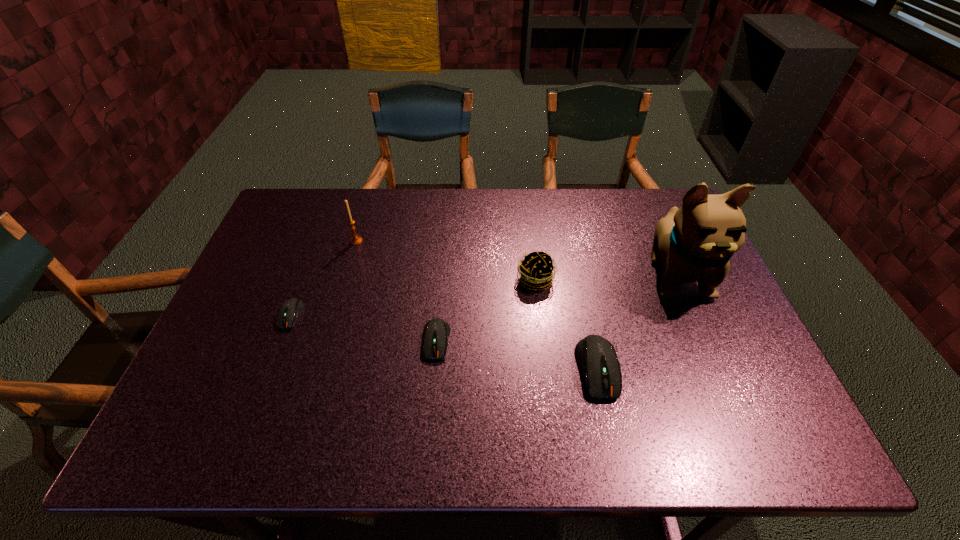
You are a GUI agent. You are given a task and a screenshot of the screen. Output one action in this format:
    pyautogui.click(x=<x>, y=<y>)
    Task: Click on the free point between the puppy and the second computer equipment from right to left
    The image size is (960, 540).
    Given the screenshot: What is the action you would take?
    pyautogui.click(x=557, y=307)

Locate which object ranks fifth in proximity to the shortest object. Please provide its 2D coordinates. Your answer should be formatted as a tuple, i.e. [(x, y)], where the tuple contains the x and y coordinates of a point satisfying the conditions above.

[(694, 243)]

Locate an element on the screen. This screenshot has height=540, width=960. object that is the second closest one to the second shortest computer equipment is located at coordinates (597, 357).

The height and width of the screenshot is (540, 960). I want to click on computer equipment that is the second closest to the second shortest object, so click(x=289, y=311).

Select which computer equipment appears as the closest to the fourth object from right to left. Please provide its 2D coordinates. Your answer should be formatted as a tuple, i.e. [(x, y)], where the tuple contains the x and y coordinates of a point satisfying the conditions above.

[(597, 357)]